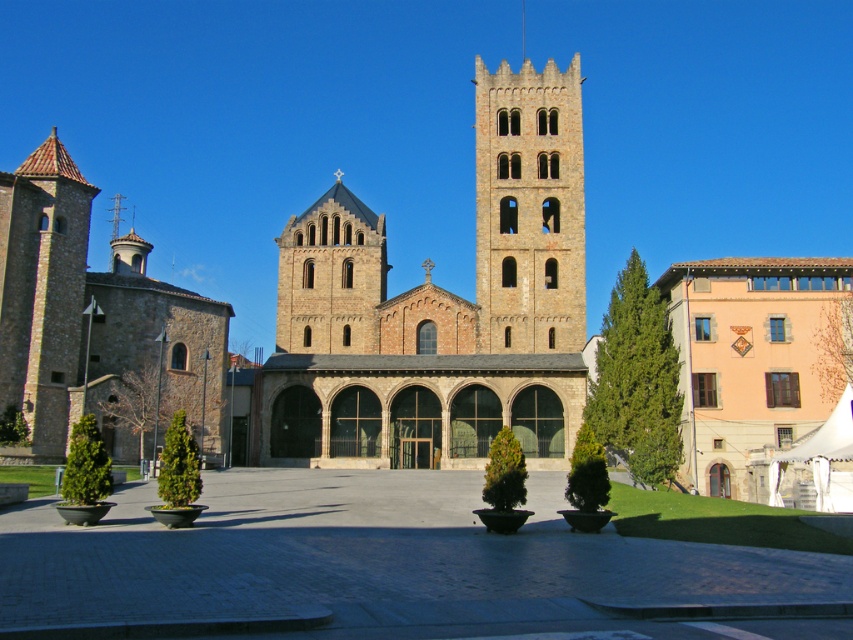
You are standing at the center of the square and want to visit the brown stone church at left. Which direction should you head towards?

The brown stone church at left is located at point (96, 324), so you should head towards the left direction to reach it.

You are standing in the square in front of the historic stone church. You see a point marked at coordinates point (96, 324). Based on the scene description, can you determine what architectural feature this point is located on?

The point (96, 324) is on the brown stone church at left, specifically on its facade which includes Gothic features like arched windows and a central bell tower.